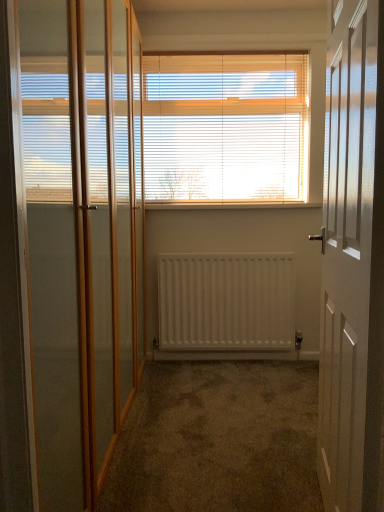
Question: From a real-world perspective, is white wood blinds at center on top of white matte radiator at center?

Choices:
 (A) yes
 (B) no

Answer: (A)

Question: Is white wood blinds at center not near white matte radiator at center?

Choices:
 (A) no
 (B) yes

Answer: (A)

Question: Is the depth of white wood blinds at center greater than that of white matte radiator at center?

Choices:
 (A) yes
 (B) no

Answer: (B)

Question: Does white wood blinds at center have a larger size compared to white matte radiator at center?

Choices:
 (A) yes
 (B) no

Answer: (A)

Question: Is white wood blinds at center not within white matte radiator at center?

Choices:
 (A) no
 (B) yes

Answer: (B)

Question: Considering the positions of white matte radiator at center and white wood blinds at center in the image, is white matte radiator at center taller or shorter than white wood blinds at center?

Choices:
 (A) tall
 (B) short

Answer: (B)

Question: Which is correct: white matte radiator at center is inside white wood blinds at center, or outside of it?

Choices:
 (A) outside
 (B) inside

Answer: (A)

Question: Is white matte radiator at center wider or thinner than white wood blinds at center?

Choices:
 (A) thin
 (B) wide

Answer: (B)

Question: From a real-world perspective, is white matte radiator at center above or below white wood blinds at center?

Choices:
 (A) below
 (B) above

Answer: (A)

Question: Is wooden at center spatially inside clear glass screen door at left, or outside of it?

Choices:
 (A) inside
 (B) outside

Answer: (B)

Question: From a real-world perspective, is wooden at center positioned above or below clear glass screen door at left?

Choices:
 (A) below
 (B) above

Answer: (B)

Question: Is wooden at center wider or thinner than clear glass screen door at left?

Choices:
 (A) thin
 (B) wide

Answer: (A)

Question: From their relative heights in the image, would you say wooden at center is taller or shorter than clear glass screen door at left?

Choices:
 (A) short
 (B) tall

Answer: (A)

Question: Is point (38, 446) closer or farther from the camera than point (241, 278)?

Choices:
 (A) closer
 (B) farther

Answer: (A)

Question: From a real-world perspective, is clear glass screen door at left above or below white matte radiator at center?

Choices:
 (A) above
 (B) below

Answer: (A)